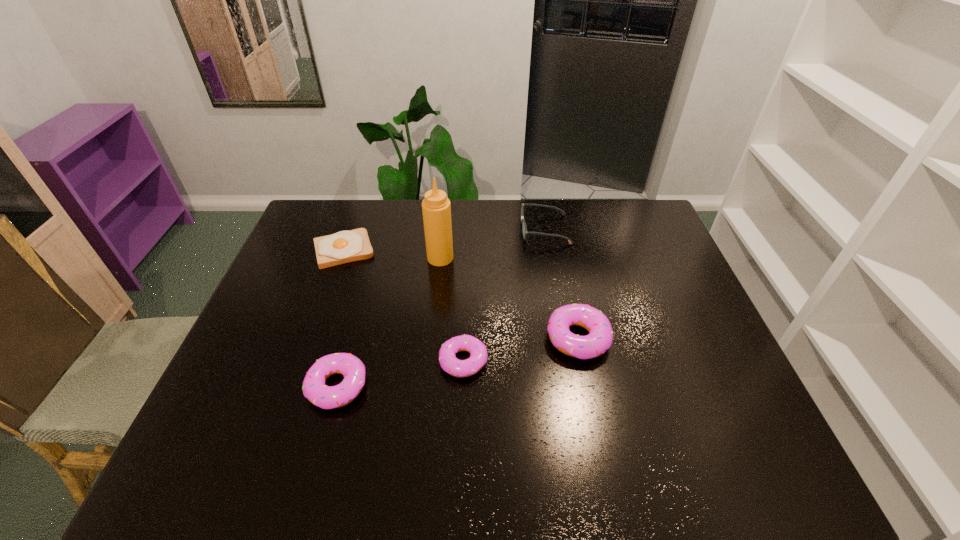
Locate an element on the screen. Image resolution: width=960 pixels, height=540 pixels. vacant region located on the face of the spectacles is located at coordinates (411, 230).

At what (x,y) coordinates should I click in order to perform the action: click on blank space located 0.380m on the face of the spectacles. Please return your answer as a coordinate pair (x, y). Looking at the image, I should click on (411, 230).

This screenshot has width=960, height=540. In order to click on blank space located on the front of the toast in this screenshot , I will do `click(317, 325)`.

The image size is (960, 540). Identify the location of free space located on the back of the condiment. (445, 205).

Identify the location of spectacles present at the far edge. The image size is (960, 540). (524, 228).

Identify the location of toast that is at the far edge. (346, 246).

Locate an element on the screen. object at the near edge is located at coordinates (352, 368).

Locate an element on the screen. Image resolution: width=960 pixels, height=540 pixels. object that is at the left edge is located at coordinates (346, 246).

Locate an element on the screen. This screenshot has width=960, height=540. object that is at the far left corner is located at coordinates (346, 246).

Locate an element on the screen. free space at the far edge of the desktop is located at coordinates (385, 209).